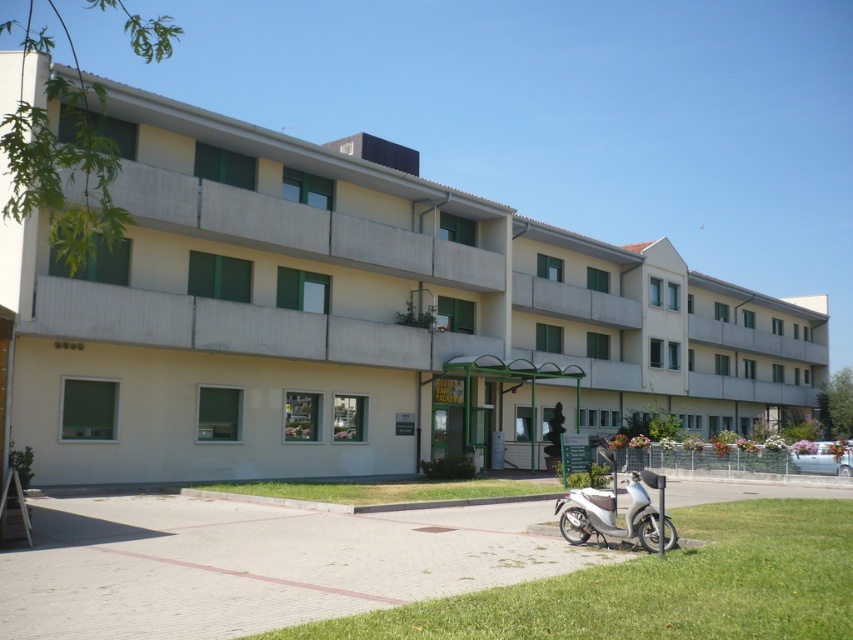
Question: Which of the following is the closest to the observer?

Choices:
 (A) (552, 625)
 (B) (426, 492)
 (C) (701, 385)

Answer: (A)

Question: Does beige concrete building at center lie in front of green grass at lower center?

Choices:
 (A) no
 (B) yes

Answer: (B)

Question: Among these points, which one is farthest from the camera?

Choices:
 (A) (646, 497)
 (B) (779, 316)
 (C) (479, 497)

Answer: (B)

Question: Is beige concrete building at center below silver metallic scooter at lower right?

Choices:
 (A) no
 (B) yes

Answer: (A)

Question: Does green grass at lower right have a lesser width compared to green grass at lower center?

Choices:
 (A) no
 (B) yes

Answer: (B)

Question: Among these points, which one is nearest to the camera?

Choices:
 (A) (434, 390)
 (B) (621, 529)
 (C) (596, 602)
 (D) (357, 490)

Answer: (C)